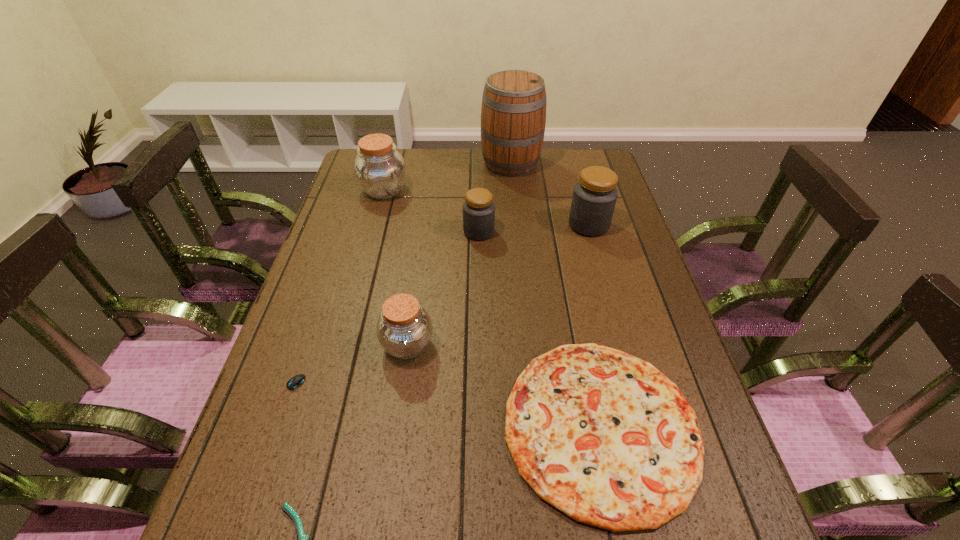
Locate an element on the screen. The height and width of the screenshot is (540, 960). vacant area at the far edge is located at coordinates (546, 153).

I want to click on free space at the left edge of the desktop, so click(x=280, y=362).

The image size is (960, 540). In order to click on free space at the right edge of the desktop in this screenshot , I will do `click(712, 449)`.

Where is `vacant area at the near left corner of the desktop`? This screenshot has width=960, height=540. vacant area at the near left corner of the desktop is located at coordinates (232, 533).

Where is `empty space between the bigger brown jar and the smaller gray jar`? empty space between the bigger brown jar and the smaller gray jar is located at coordinates pyautogui.click(x=431, y=211).

The image size is (960, 540). I want to click on free point between the cider and the farthest jar, so click(447, 177).

This screenshot has height=540, width=960. I want to click on vacant area that lies between the nearest jar and the pizza, so click(504, 385).

Identify the location of free space between the tallest object and the nearest jar. The image size is (960, 540). (459, 254).

The height and width of the screenshot is (540, 960). I want to click on the seventh closest object relative to the third jar from left to right, so click(x=303, y=539).

At what (x,y) coordinates should I click in order to perform the action: click on object that stands as the third closest to the cider. Please return your answer as a coordinate pair (x, y). Image resolution: width=960 pixels, height=540 pixels. Looking at the image, I should click on (380, 170).